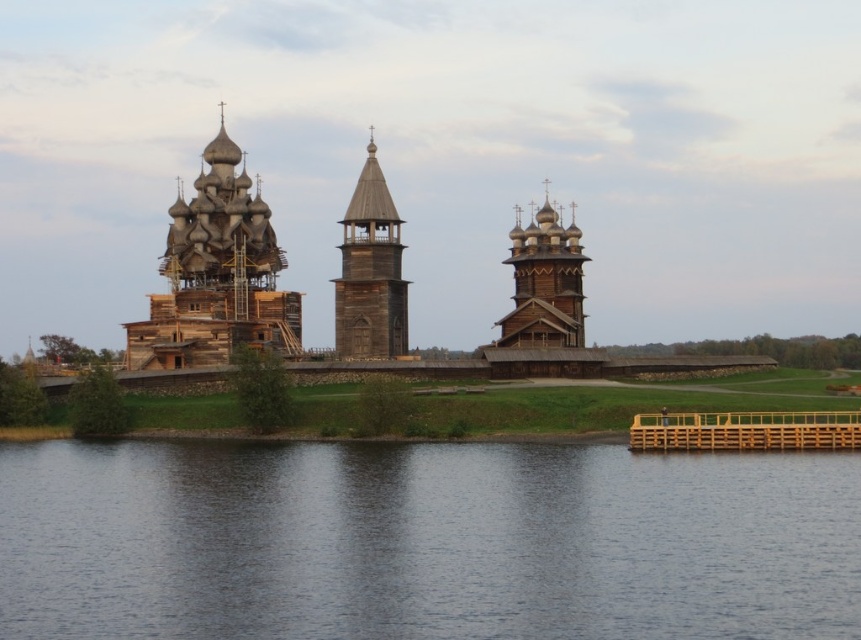
Question: Does wooden church at left appear under brown wooden tower at center?

Choices:
 (A) no
 (B) yes

Answer: (B)

Question: Which of the following is the farthest from the observer?

Choices:
 (A) (378, 212)
 (B) (183, 259)
 (C) (577, 336)
 (D) (129, 467)

Answer: (C)

Question: Which point is farther from the camera taking this photo?

Choices:
 (A) (174, 292)
 (B) (578, 515)
 (C) (547, 260)

Answer: (C)

Question: Does dark blue water at lower center appear over wooden church at left?

Choices:
 (A) yes
 (B) no

Answer: (B)

Question: Does dark blue water at lower center lie behind wooden church at left?

Choices:
 (A) yes
 (B) no

Answer: (B)

Question: Among these points, which one is nearest to the camera?

Choices:
 (A) (523, 320)
 (B) (468, 556)

Answer: (B)